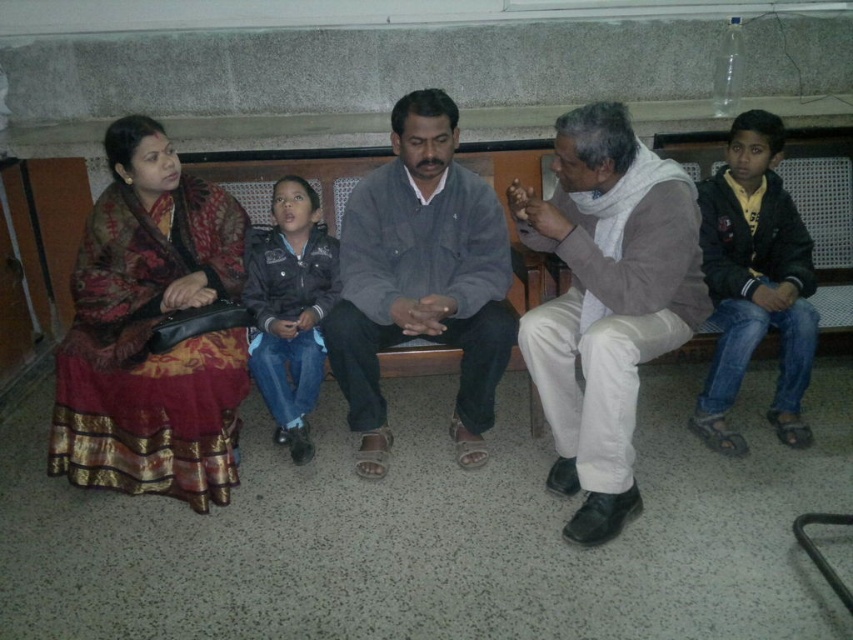
Does reddish-brown silk saree at left appear under gray cotton shirt at center?

Yes, reddish-brown silk saree at left is below gray cotton shirt at center.

Does reddish-brown silk saree at left have a greater height compared to gray cotton shirt at center?

Yes.

Is point (146, 193) closer to viewer compared to point (496, 298)?

No, it is behind (496, 298).

What are the coordinates of `reddish-brown silk saree at left` in the screenshot? It's located at (149, 332).

Which is more to the left, gray cotton shirt at center or dark blue jacket at right?

gray cotton shirt at center

Does gray cotton shirt at center have a lesser width compared to dark blue jacket at right?

No.

Who is more forward, (505,292) or (808,442)?

Point (505,292)

Where is `gray cotton shirt at center`? The width and height of the screenshot is (853, 640). gray cotton shirt at center is located at coordinates (421, 278).

Is white cotton scarf at center wider than dark blue jacket at right?

Yes, white cotton scarf at center is wider than dark blue jacket at right.

Does point (618, 406) come in front of point (775, 131)?

Yes, it is.

You are a GUI agent. You are given a task and a screenshot of the screen. Output one action in this format:
    pyautogui.click(x=<x>, y=<y>)
    Task: Click on the white cotton scarf at center
    This screenshot has width=853, height=640.
    Given the screenshot: What is the action you would take?
    pyautogui.click(x=606, y=301)